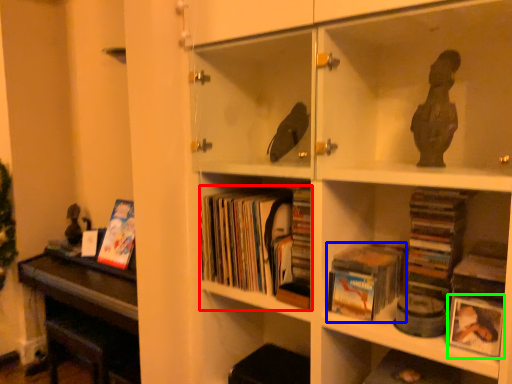
Question: Which is farther away from book (highlighted by a red box)? book (highlighted by a blue box) or paperback book (highlighted by a green box)?

Choices:
 (A) book
 (B) paperback book

Answer: (B)